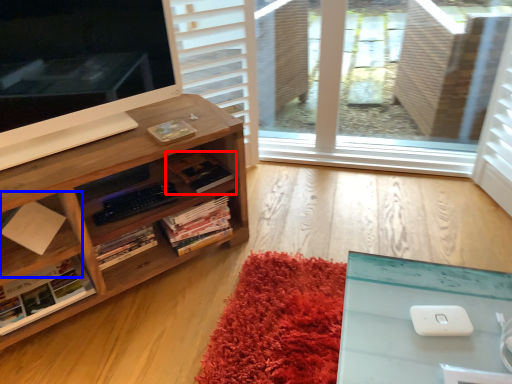
Question: Which point is closer to the camera, book (highlighted by a red box) or shelf (highlighted by a blue box)?

Choices:
 (A) book
 (B) shelf

Answer: (B)